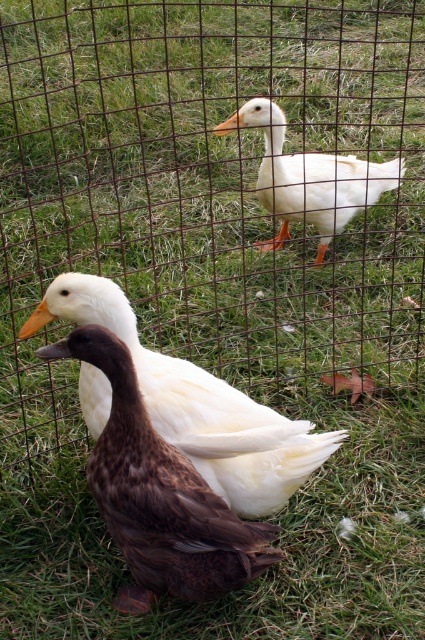
Looking at this image, you are a photographer trying to capture a closeup of both the brown feathered duck at center and the white matte duck at center. Given that your camera can only focus on objects within a 20 cm range, will you be able to capture both ducks in the same frame without moving the camera?

The brown feathered duck at center is 17.03 centimeters from the white matte duck at center, so yes, both ducks can be captured in the same frame since the distance between them is within the camera focus range of 20 cm.

You are a photographer trying to capture both the brown feathered duck at center and the white matte duck at center in a single frame. Based on their sizes in the image, which duck would appear smaller in the photo?

The brown feathered duck at center appears smaller in the photo because it occupies less space than the white matte duck at center.